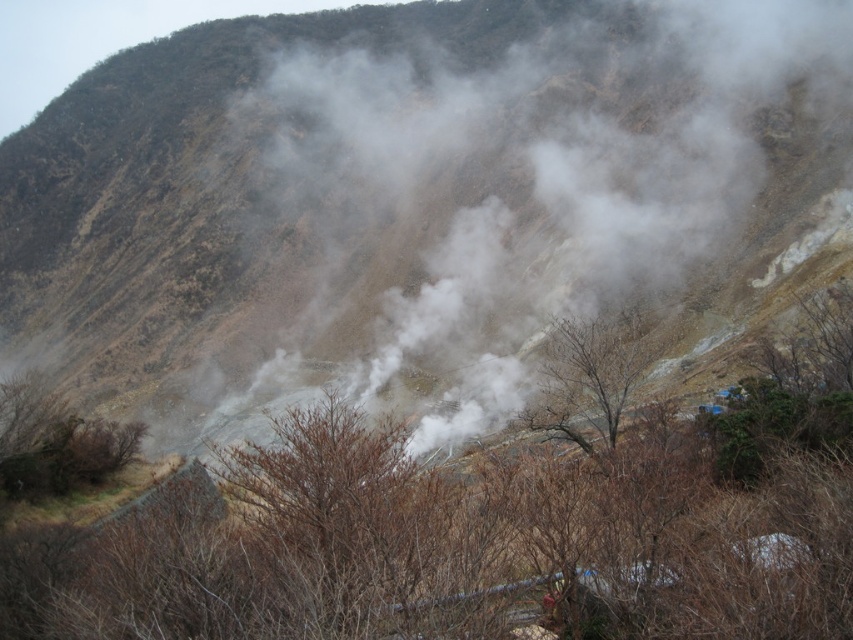
You are a hiker planning to climb the brown rocky mountain at center and want to take a photo of the brown leafless tree at center from the summit. Based on the scene, will the tree be visible from the top of the mountain?

The brown rocky mountain at center is located above the brown leafless tree at center, so from the summit of the mountain, the tree would be visible below it.

In the scene shown: You are a hiker planning to cross the area between the brown rocky mountain at center and the brown leafless tree at lower left. Which object has a greater width, and how might this affect your path?

The brown rocky mountain at center has a greater width than the brown leafless tree at lower left. This means the mountain occupies more horizontal space, so your path should account for its broader base, possibly requiring a detour around it to avoid steep terrain.